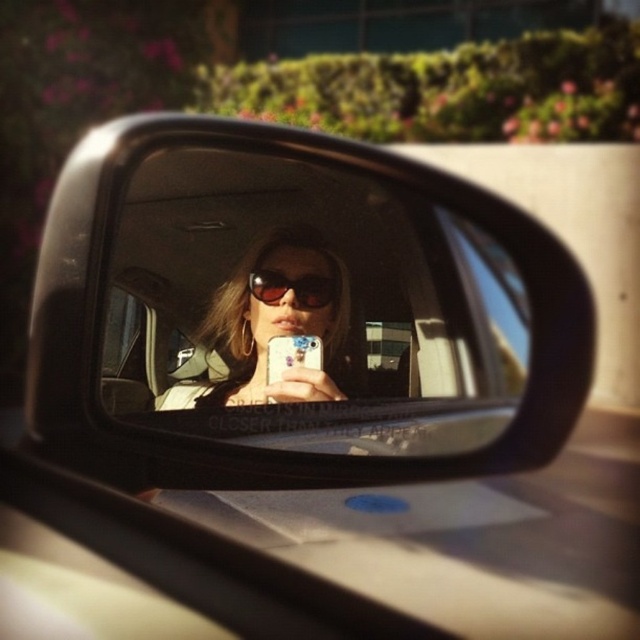
Consider the image. Is matte plastic mirror at center closer to camera compared to sunglasses at center?

Yes, it is.

Which of these two, matte plastic mirror at center or sunglasses at center, stands taller?

matte plastic mirror at center

Is point (300, 182) behind point (272, 298)?

Yes, it is behind point (272, 298).

Where is `matte plastic mirror at center`? The height and width of the screenshot is (640, 640). matte plastic mirror at center is located at coordinates (307, 310).

Does point (333, 433) lie in front of point (353, 376)?

Yes, it is.

Between matte plastic mirror at center and matte black sunglasses at center, which one is positioned higher?

matte plastic mirror at center

The width and height of the screenshot is (640, 640). Find the location of `matte plastic mirror at center`. matte plastic mirror at center is located at coordinates (307, 310).

Measure the distance between point (346, 387) and camera.

Point (346, 387) and camera are 1.12 meters apart from each other.

Is matte black sunglasses at center taller than sunglasses at center?

Yes, matte black sunglasses at center is taller than sunglasses at center.

Is point (291, 256) closer to viewer compared to point (320, 288)?

No.

The height and width of the screenshot is (640, 640). What are the coordinates of `matte black sunglasses at center` in the screenshot? It's located at (273, 324).